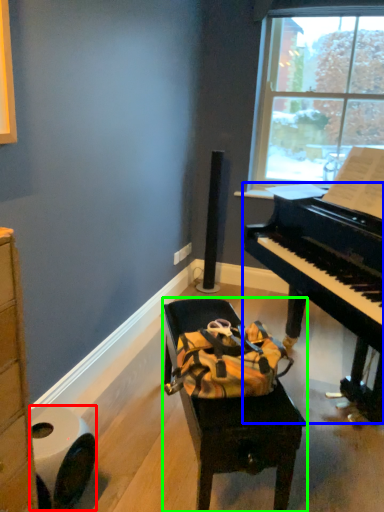
Question: Which object is the farthest from toilet paper (highlighted by a red box)? Choose among these: piano (highlighted by a blue box) or furniture (highlighted by a green box).

Choices:
 (A) piano
 (B) furniture

Answer: (A)